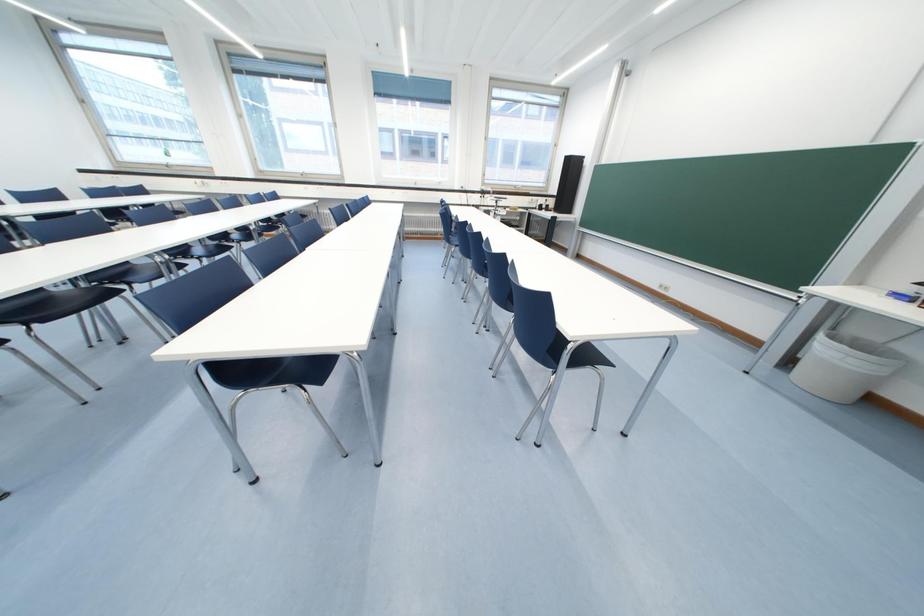
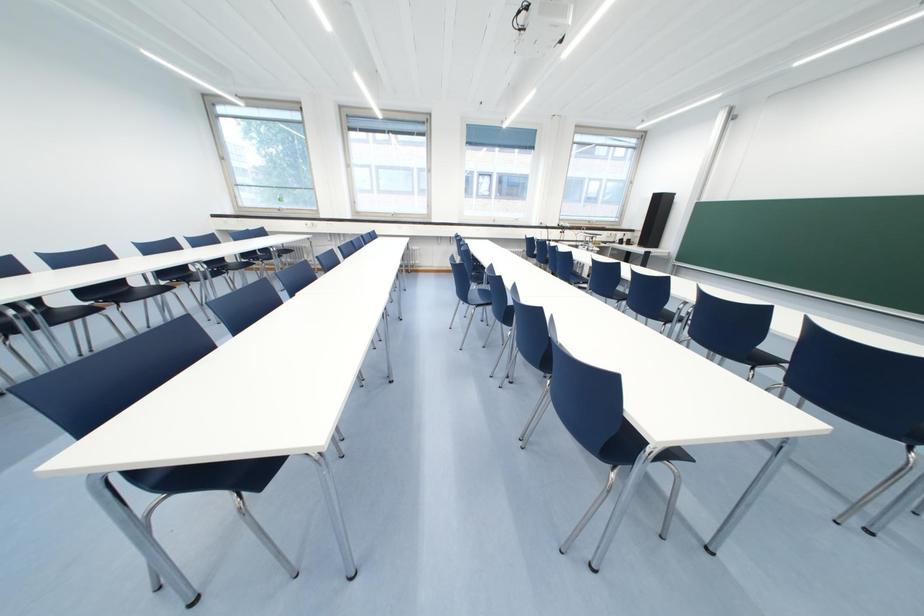
Question: What movement of the cameraman would produce the second image?

Choices:
 (A) Left
 (B) Right
 (C) Forward
 (D) Backward

Answer: (A)